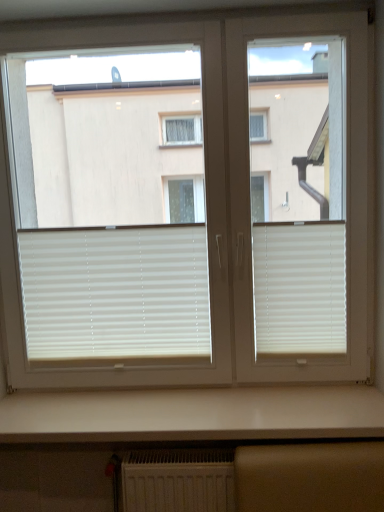
Question: Is white matte blinds at center, placed as the first window blind when sorted from left to right, not inside white matte blinds at center?

Choices:
 (A) yes
 (B) no

Answer: (A)

Question: Is white matte blinds at center, marked as the 2th window blind in a right-to-left arrangement, turned away from white matte blinds at center?

Choices:
 (A) yes
 (B) no

Answer: (B)

Question: Can you confirm if white matte blinds at center, placed as the first window blind when sorted from left to right, is bigger than white matte blinds at center?

Choices:
 (A) yes
 (B) no

Answer: (B)

Question: Is white matte blinds at center, marked as the 2th window blind in a right-to-left arrangement, positioned in front of white matte blinds at center?

Choices:
 (A) yes
 (B) no

Answer: (B)

Question: Could white matte blinds at center be considered to be inside white matte blinds at center, placed as the first window blind when sorted from left to right?

Choices:
 (A) no
 (B) yes

Answer: (A)

Question: Does white matte blinds at center, placed as the first window blind when sorted from left to right, have a smaller size compared to white matte blinds at center?

Choices:
 (A) yes
 (B) no

Answer: (A)

Question: Is white glossy counter top at lower center closer to the viewer compared to white matte blinds at center, marked as the 2th window blind in a right-to-left arrangement?

Choices:
 (A) yes
 (B) no

Answer: (A)

Question: From a real-world perspective, is white glossy counter top at lower center under white matte blinds at center, marked as the 2th window blind in a right-to-left arrangement?

Choices:
 (A) no
 (B) yes

Answer: (B)

Question: Is white glossy counter top at lower center taller than white matte blinds at center, placed as the first window blind when sorted from left to right?

Choices:
 (A) no
 (B) yes

Answer: (A)

Question: Is white glossy counter top at lower center positioned far away from white matte blinds at center, marked as the 2th window blind in a right-to-left arrangement?

Choices:
 (A) no
 (B) yes

Answer: (A)

Question: Is white glossy counter top at lower center looking in the opposite direction of white matte blinds at center, marked as the 2th window blind in a right-to-left arrangement?

Choices:
 (A) no
 (B) yes

Answer: (A)

Question: Considering the relative sizes of white glossy counter top at lower center and white matte blinds at center, marked as the 2th window blind in a right-to-left arrangement, in the image provided, is white glossy counter top at lower center smaller than white matte blinds at center, marked as the 2th window blind in a right-to-left arrangement,?

Choices:
 (A) yes
 (B) no

Answer: (B)

Question: Does white glossy counter top at lower center have a greater width compared to white matte blinds at center?

Choices:
 (A) no
 (B) yes

Answer: (B)